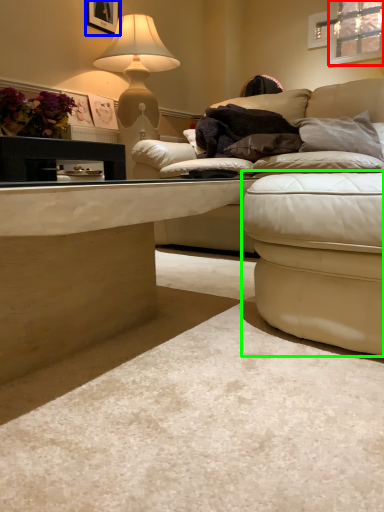
Question: Considering the real-world distances, which object is closest to window (highlighted by a red box)? picture frame (highlighted by a blue box) or swivel chair (highlighted by a green box).

Choices:
 (A) picture frame
 (B) swivel chair

Answer: (A)